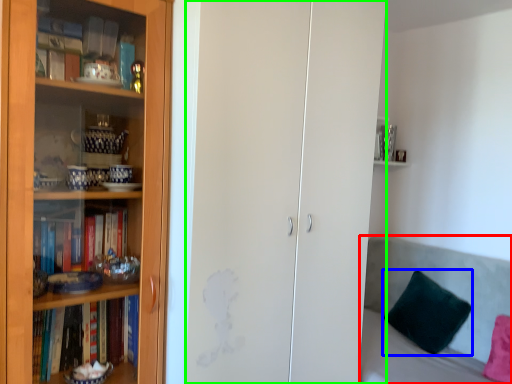
Question: Considering the real-world distances, which object is farthest from couch (highlighted by a red box)? pillow (highlighted by a blue box) or glass door (highlighted by a green box)?

Choices:
 (A) pillow
 (B) glass door

Answer: (B)